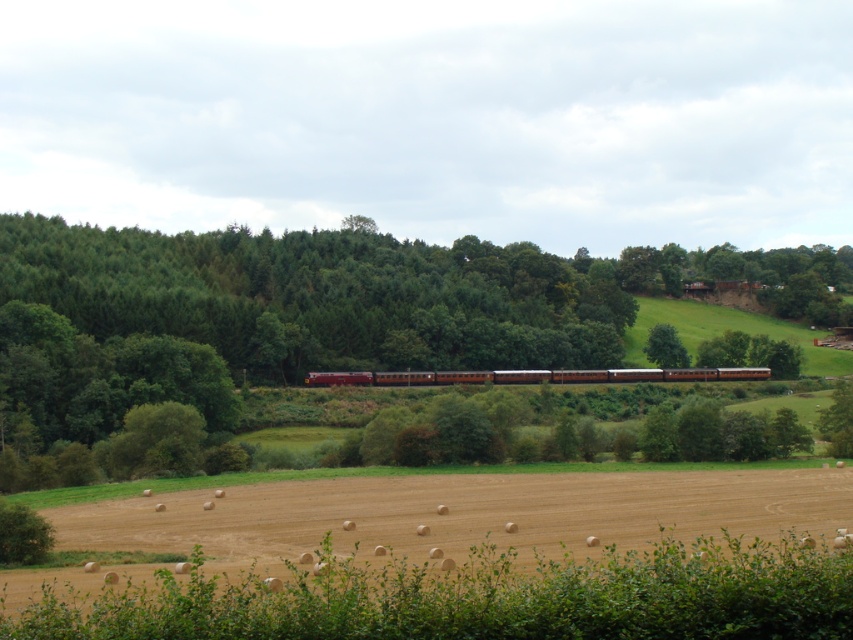
Looking at this image, who is taller, brown polished wood passenger train at center or green leafy tree at upper center?

green leafy tree at upper center

This screenshot has height=640, width=853. Describe the element at coordinates (534, 376) in the screenshot. I see `brown polished wood passenger train at center` at that location.

Which is in front, point (712, 372) or point (656, 356)?

Point (712, 372) is more forward.

At what (x,y) coordinates should I click in order to perform the action: click on brown polished wood passenger train at center. Please return your answer as a coordinate pair (x, y). This screenshot has height=640, width=853. Looking at the image, I should click on (534, 376).

Does green leafy tree at center appear on the left side of brown polished wood passenger train at center?

Yes, green leafy tree at center is to the left of brown polished wood passenger train at center.

Identify the location of green leafy tree at center. (291, 310).

What do you see at coordinates (291, 310) in the screenshot? I see `green leafy tree at center` at bounding box center [291, 310].

Where is `green leafy tree at center`? This screenshot has height=640, width=853. green leafy tree at center is located at coordinates (291, 310).

Is green leafy tree at center further to the viewer compared to green leafy tree at upper center?

No, green leafy tree at center is in front of green leafy tree at upper center.

Which is behind, point (819, 273) or point (672, 356)?

Positioned behind is point (819, 273).

Locate an element on the screen. The height and width of the screenshot is (640, 853). green leafy tree at center is located at coordinates (291, 310).